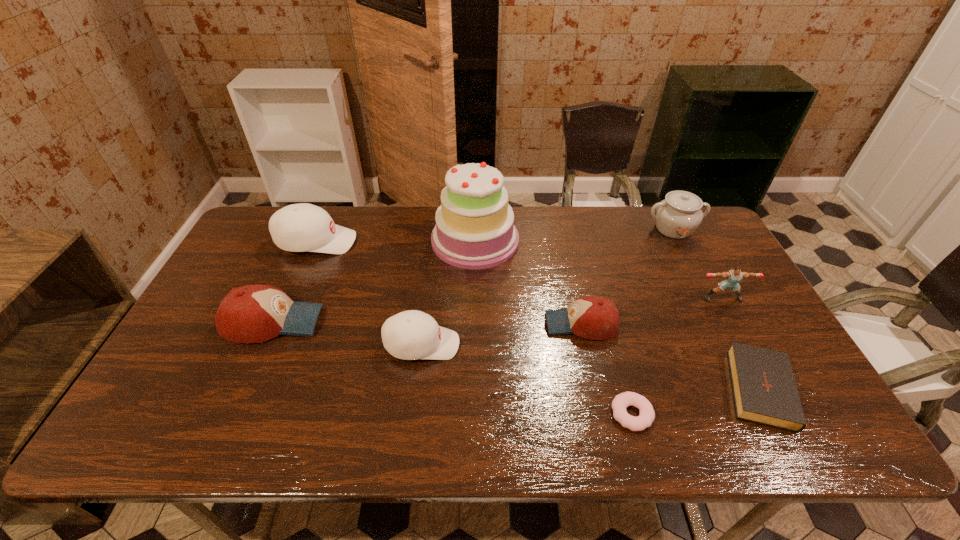
The width and height of the screenshot is (960, 540). Identify the location of the right red baseball cap. (591, 317).

Identify the location of Bible. This screenshot has width=960, height=540. (764, 389).

Identify the location of the shortest object. (619, 404).

You are a GUI agent. You are given a task and a screenshot of the screen. Output one action in this format:
    pyautogui.click(x=<x>, y=<y>)
    Task: Click on the vacant space situated 0.320m on the left of the tallest object
    
    Given the screenshot: What is the action you would take?
    pyautogui.click(x=335, y=240)

The height and width of the screenshot is (540, 960). In order to click on vacant region located on the front of the white chinaware in this screenshot , I will do `click(705, 289)`.

Locate an element on the screen. The image size is (960, 540). free space located 0.130m on the front-facing side of the left white baseball cap is located at coordinates (396, 242).

Find the location of a particular element. The height and width of the screenshot is (540, 960). vacant space situated 0.340m on the front-facing side of the puncher is located at coordinates (783, 410).

The image size is (960, 540). I want to click on vacant space situated 0.300m on the front-facing side of the left red baseball cap, so click(430, 322).

Identify the location of blank space located on the front-facing side of the smaller white baseball cap. This screenshot has width=960, height=540. (592, 345).

Identify the location of free space located on the front-facing side of the rightmost baseball cap. This screenshot has height=540, width=960. (494, 324).